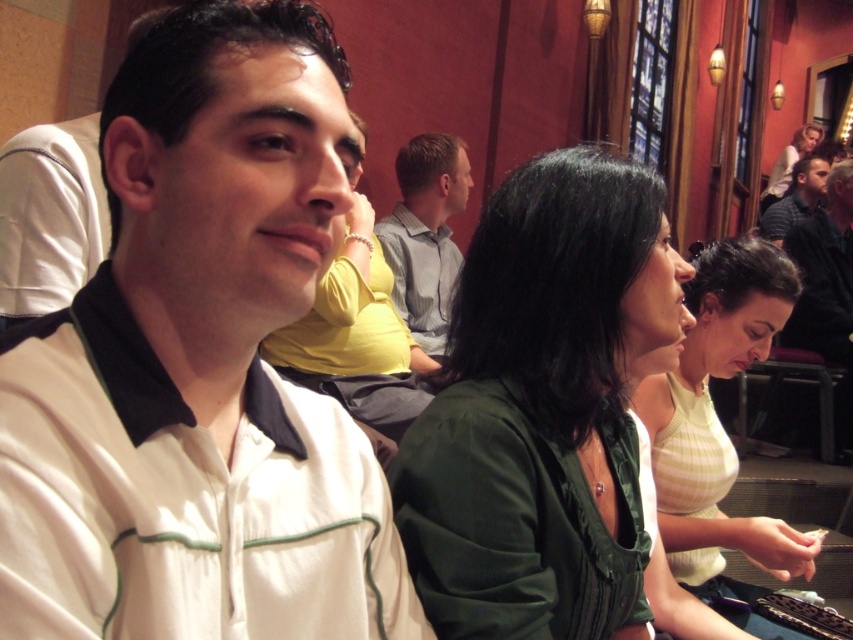
Which of these two, white fabric shirt at left or matte green blouse at center, stands taller?

Standing taller between the two is matte green blouse at center.

Does white fabric shirt at left have a larger size compared to matte green blouse at center?

Incorrect, white fabric shirt at left is not larger than matte green blouse at center.

The image size is (853, 640). I want to click on white fabric shirt at left, so click(199, 365).

The height and width of the screenshot is (640, 853). What are the coordinates of `white fabric shirt at left` in the screenshot? It's located at (199, 365).

Who is positioned more to the left, green fabric shirt at center or light green knit sweater at center?

Positioned to the left is green fabric shirt at center.

Is green fabric shirt at center closer to the viewer compared to light green knit sweater at center?

Yes, green fabric shirt at center is closer to the viewer.

The height and width of the screenshot is (640, 853). Identify the location of green fabric shirt at center. coord(543,410).

Between point (262, 264) and point (793, 138), which one is positioned in front?

Point (262, 264) is in front.

Is white fabric shirt at left bigger than matte black hair at upper right?

Actually, white fabric shirt at left might be smaller than matte black hair at upper right.

Which is behind, point (379, 548) or point (775, 179)?

The point (775, 179) is behind.

I want to click on white fabric shirt at left, so click(x=199, y=365).